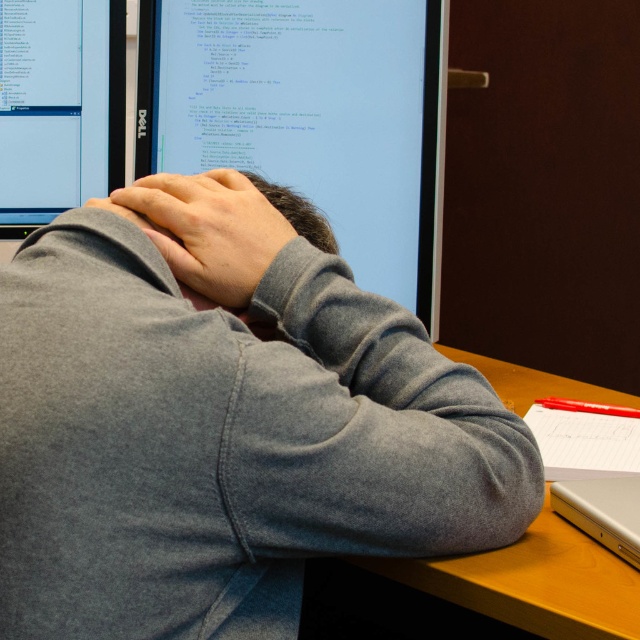
You are a photographer taking a picture of the scene. You want to focus on the point at coordinate point (x=339, y=157) and point (x=636, y=586). Which point should you focus on first to ensure both are in focus?

You should focus on point (x=339, y=157) first because it is closer to the camera than point (x=636, y=586). By focusing on the closer point, the farther point will also be in focus due to the depth of field.

You are organizing a desk and need to place a matte black monitor at center and a wooden at center. Given their sizes, which one should you place first to ensure proper arrangement?

The matte black monitor at center is larger than the wooden at center, so you should place the matte black monitor at center first to accommodate its size in the desk arrangement.